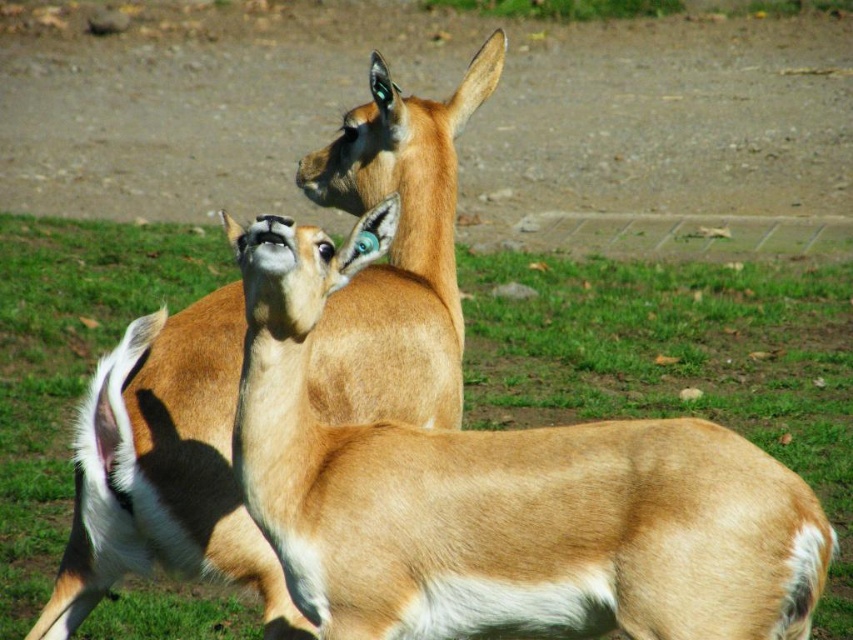
Question: Which point is farther to the camera?

Choices:
 (A) [x=199, y=456]
 (B) [x=659, y=572]

Answer: (A)

Question: Considering the relative positions of brown furry deer at center and brown furry deer at upper center in the image provided, where is brown furry deer at center located with respect to brown furry deer at upper center?

Choices:
 (A) above
 (B) below

Answer: (B)

Question: Which of the following is the closest to the observer?

Choices:
 (A) brown furry deer at upper center
 (B) brown furry deer at center

Answer: (B)

Question: Is the position of brown furry deer at center less distant than that of brown furry deer at upper center?

Choices:
 (A) no
 (B) yes

Answer: (B)

Question: From the image, what is the correct spatial relationship of brown furry deer at center in relation to brown furry deer at upper center?

Choices:
 (A) right
 (B) left

Answer: (A)